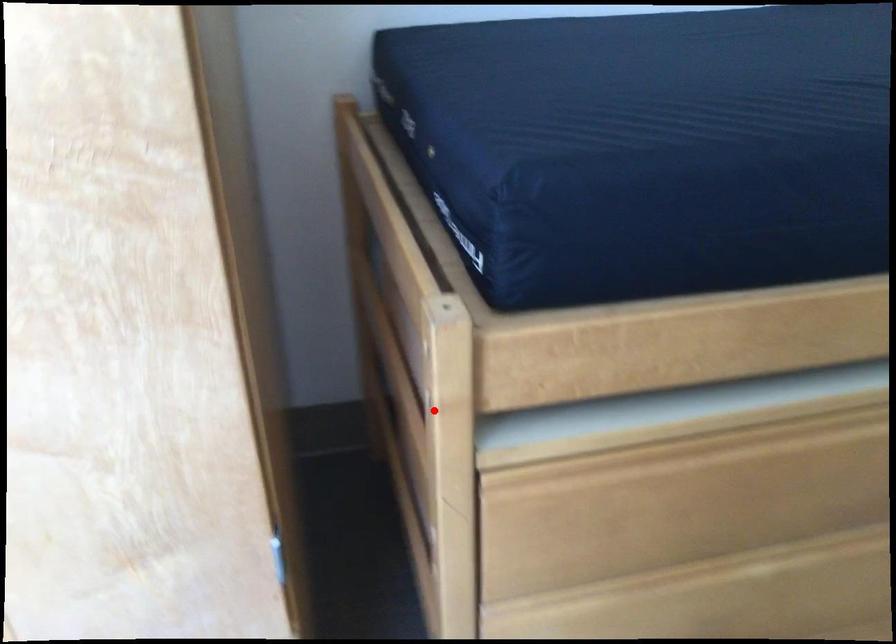
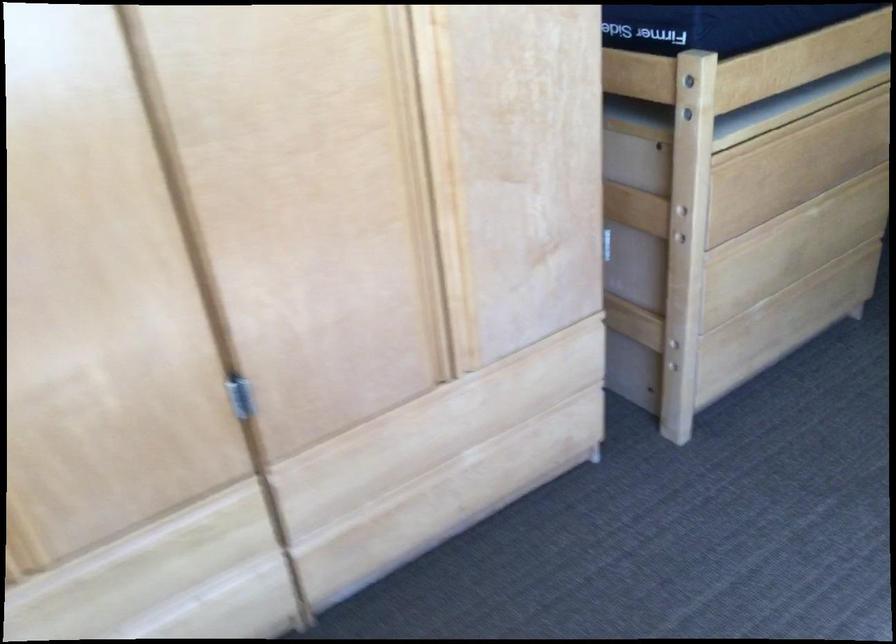
Find the pixel in the second image that matches the highlighted location in the first image.

(688, 116)